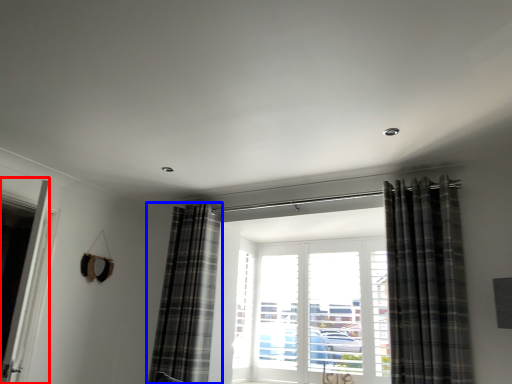
Question: Which object is further to the camera taking this photo, screen door (highlighted by a red box) or curtain (highlighted by a blue box)?

Choices:
 (A) screen door
 (B) curtain

Answer: (B)